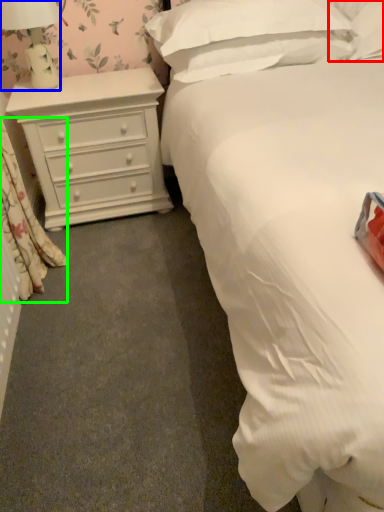
Question: Which object is the farthest from pillow (highlighted by a red box)? Choose among these: lamp (highlighted by a blue box) or curtain (highlighted by a green box).

Choices:
 (A) lamp
 (B) curtain

Answer: (B)